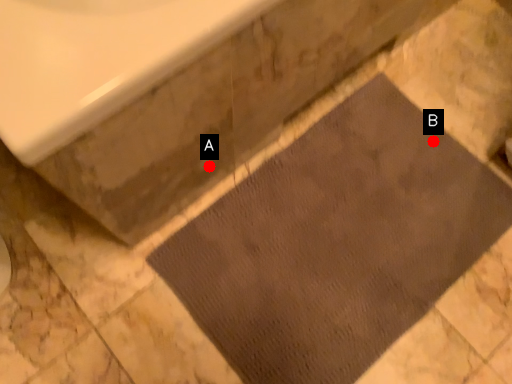
Question: Two points are circled on the image, labeled by A and B beside each circle. Which point is closer to the camera taking this photo?

Choices:
 (A) A is closer
 (B) B is closer

Answer: (A)